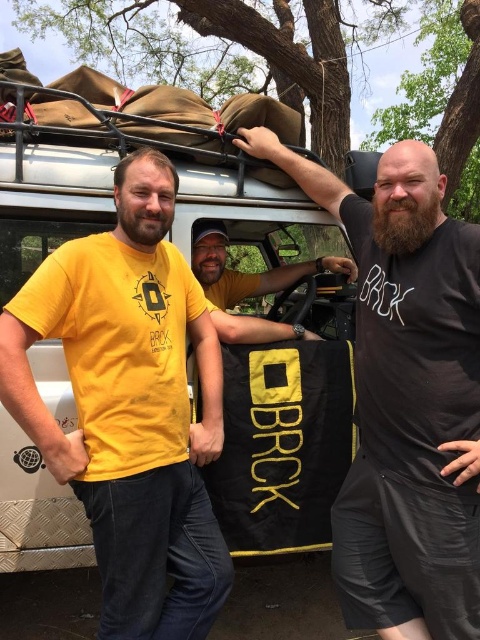
Question: Is yellow matte t-shirt at left closer to the viewer compared to black matte bag at upper center?

Choices:
 (A) yes
 (B) no

Answer: (A)

Question: From the image, what is the correct spatial relationship of black matte bag at upper center in relation to yellow t-shirt at center?

Choices:
 (A) above
 (B) below

Answer: (B)

Question: Where is yellow matte t-shirt at left located in relation to black matte bag at upper center in the image?

Choices:
 (A) left
 (B) right

Answer: (A)

Question: Estimate the real-world distances between objects in this image. Which object is farther from the yellow matte t-shirt at left?

Choices:
 (A) yellow t-shirt at center
 (B) black matte bag at upper center

Answer: (B)

Question: Which point is closer to the camera taking this photo?

Choices:
 (A) (214, 237)
 (B) (85, 332)

Answer: (B)

Question: Which of the following is the closest to the observer?

Choices:
 (A) yellow matte t-shirt at left
 (B) yellow t-shirt at center

Answer: (A)